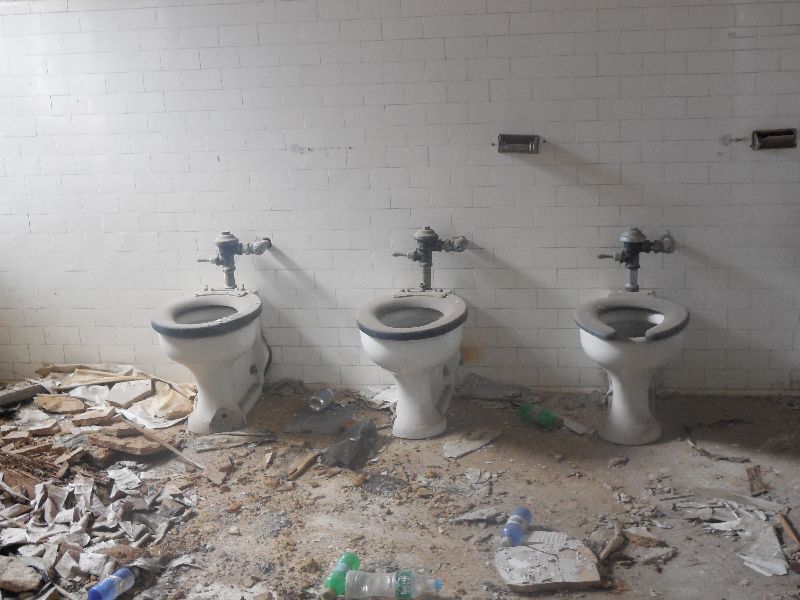
The width and height of the screenshot is (800, 600). In order to click on toilet in this screenshot , I will do `click(412, 360)`.